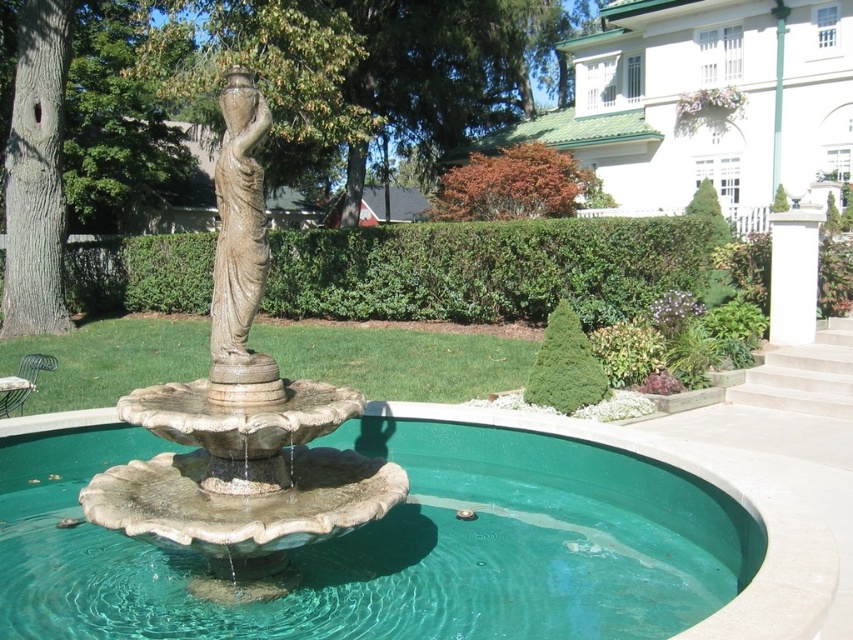
Question: Which point is farther to the camera?

Choices:
 (A) stone statue at center
 (B) clear glass pool at center
 (C) green leafy hedge at center
 (D) matte bronze statue at center

Answer: (C)

Question: Is clear glass pool at center to the right of green leafy hedge at center from the viewer's perspective?

Choices:
 (A) yes
 (B) no

Answer: (A)

Question: Does stone statue at center appear on the right side of matte bronze statue at center?

Choices:
 (A) yes
 (B) no

Answer: (A)

Question: Which of the following is the farthest from the observer?

Choices:
 (A) stone statue at center
 (B) clear glass pool at center
 (C) green leafy hedge at center

Answer: (C)

Question: Is stone statue at center bigger than matte bronze statue at center?

Choices:
 (A) yes
 (B) no

Answer: (B)

Question: Which of the following is the closest to the observer?

Choices:
 (A) (173, 634)
 (B) (212, 422)

Answer: (B)